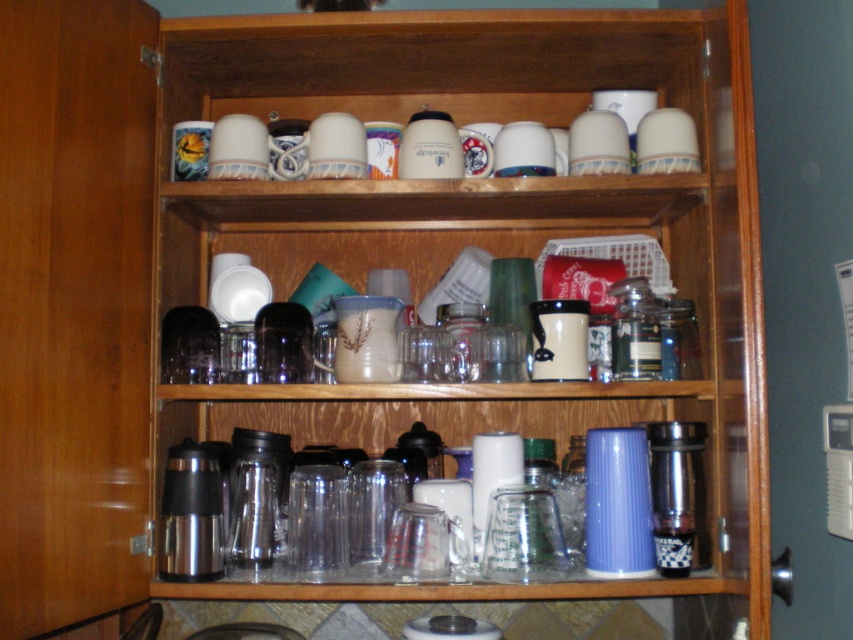
You are organizing the kitchen cabinet and need to place a new item between the translucent glass cups at upper center and the metallic thermos at lower center. Based on their current positions, which direction should you move the thermos to make space?

The translucent glass cups at upper center are located above the metallic thermos at lower center. To make space between them, you should move the metallic thermos at lower center downward.